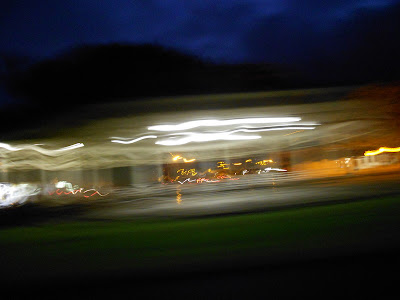
The image size is (400, 300). Find the location of `light lines`. light lines is located at coordinates (189, 126).